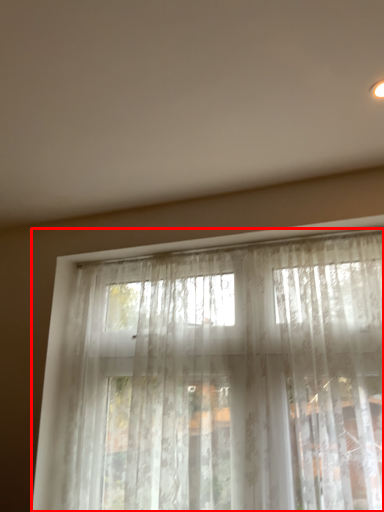
Question: From the image's perspective, where is curtain (annotated by the red box) located relative to backdrop?

Choices:
 (A) above
 (B) below

Answer: (B)